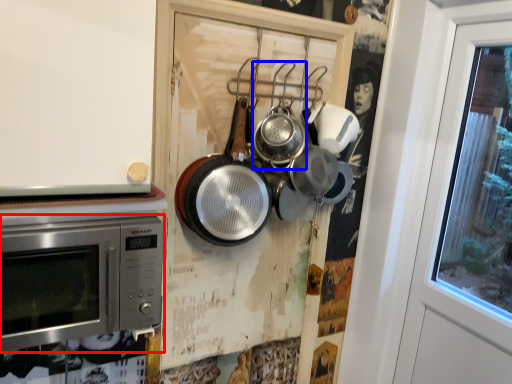
Question: Among these objects, which one is farthest to the camera, microwave oven (highlighted by a red box) or frying pan (highlighted by a blue box)?

Choices:
 (A) microwave oven
 (B) frying pan

Answer: (B)